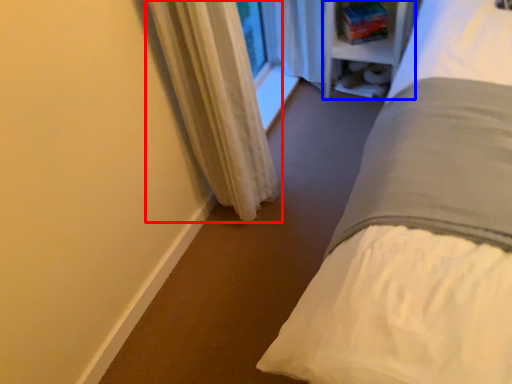
Question: Which point is further to the camera, curtain (highlighted by a red box) or bookshelf (highlighted by a blue box)?

Choices:
 (A) curtain
 (B) bookshelf

Answer: (B)